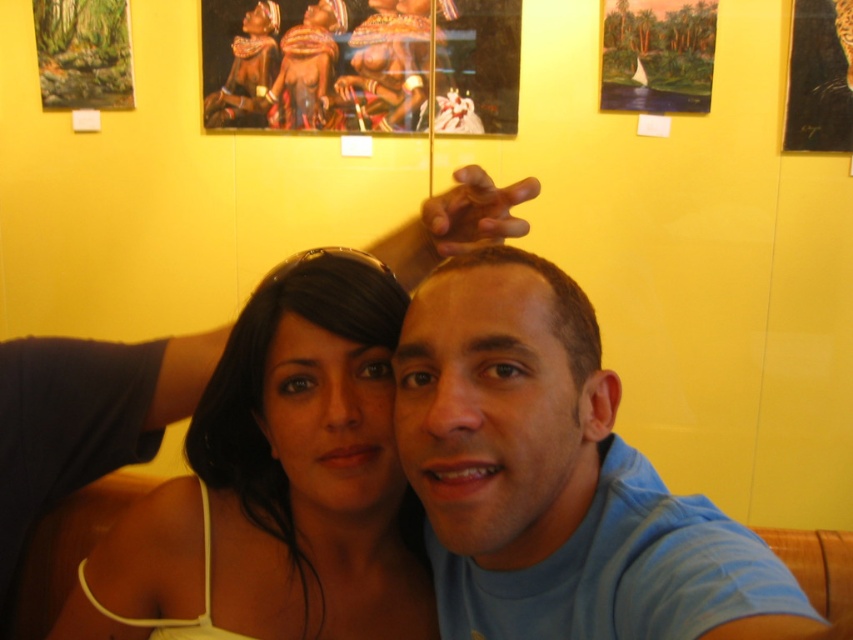
Question: Which object is the farthest from the blue cotton shirt at center?

Choices:
 (A) wooden picture frame at upper right
 (B) matte white tank top at center

Answer: (A)

Question: Can you confirm if matte wooden picture frame at upper center is positioned to the right of matte wooden frame at upper left?

Choices:
 (A) no
 (B) yes

Answer: (B)

Question: Which object is closer to the camera taking this photo?

Choices:
 (A) matte wooden frame at upper left
 (B) matte white tank top at center
 (C) brown matte hair at center
 (D) matte wooden picture frame at upper center

Answer: (C)

Question: Is oil painting landscape at upper center further to the viewer compared to brown matte hair at center?

Choices:
 (A) no
 (B) yes

Answer: (B)

Question: Which point appears closest to the camera in this image?

Choices:
 (A) (553, 312)
 (B) (648, 605)
 (C) (640, 77)
 (D) (83, 36)

Answer: (B)

Question: Is oil painting landscape at upper center smaller than matte wooden frame at upper left?

Choices:
 (A) yes
 (B) no

Answer: (A)